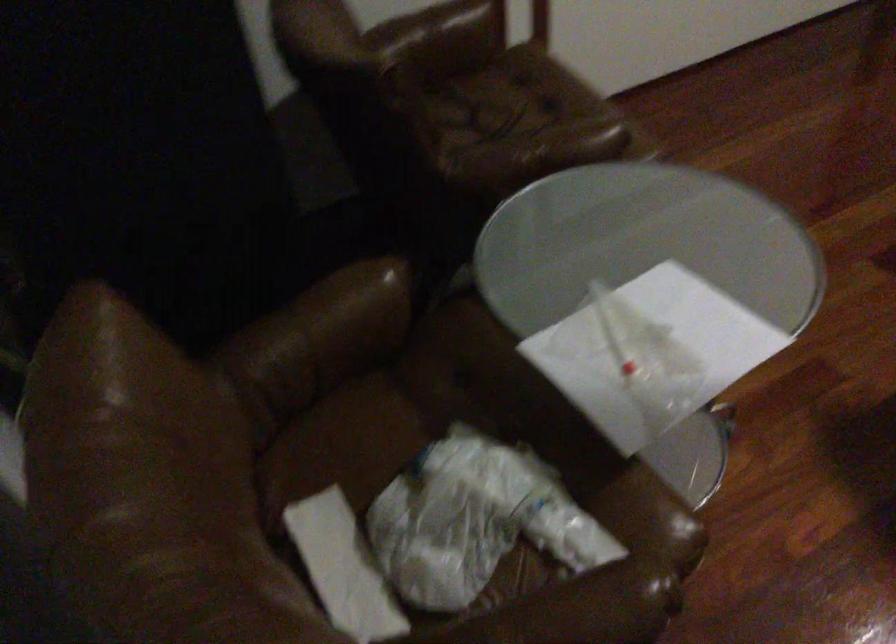
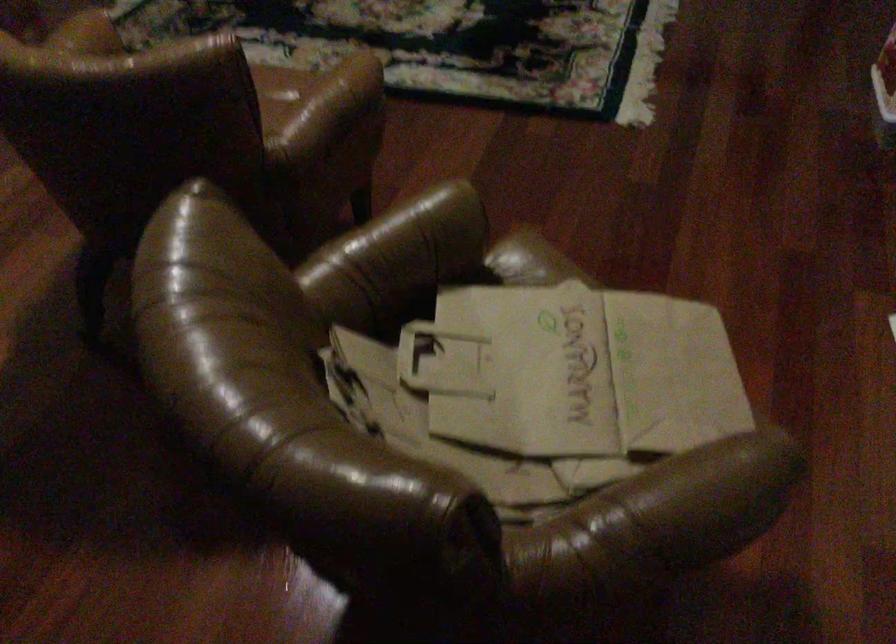
Question: The images are taken continuously from a first-person perspective. In which direction is your viewpoint rotating?

Choices:
 (A) Left
 (B) Right
 (C) Up
 (D) Down

Answer: (B)